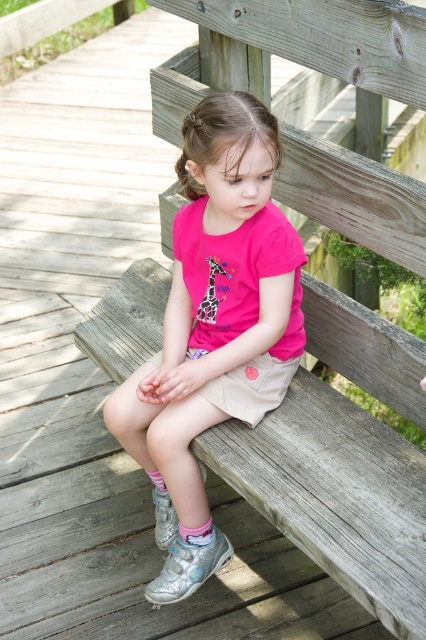
Question: Is pink matte shirt at center closer to camera compared to wooden bench at center?

Choices:
 (A) yes
 (B) no

Answer: (B)

Question: Which of the following is the farthest from the observer?

Choices:
 (A) (117, 291)
 (B) (258, 170)

Answer: (A)

Question: Is the position of pink matte shirt at center more distant than that of wooden bench at center?

Choices:
 (A) no
 (B) yes

Answer: (B)

Question: Is pink matte shirt at center wider than wooden bench at center?

Choices:
 (A) yes
 (B) no

Answer: (B)

Question: Which point is farther from the camera taking this photo?

Choices:
 (A) (247, 358)
 (B) (126, 353)

Answer: (B)